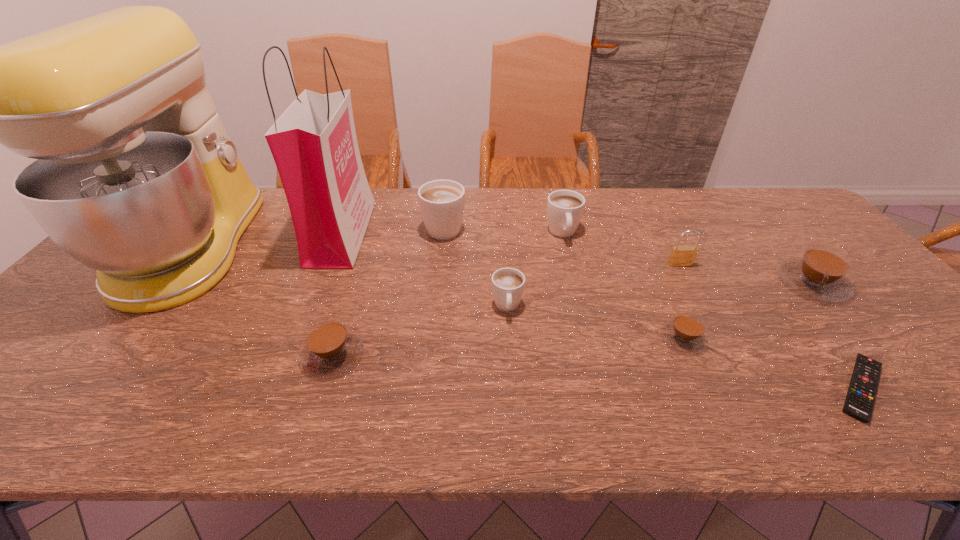
Where is `object present at the near edge`? The height and width of the screenshot is (540, 960). object present at the near edge is located at coordinates (859, 402).

At what (x,y) coordinates should I click in order to perform the action: click on object that is at the left edge. Please return your answer as a coordinate pair (x, y). Looking at the image, I should click on (136, 177).

Where is `object that is at the right edge`? The image size is (960, 540). object that is at the right edge is located at coordinates (821, 273).

Where is `object at the far left corner`? The image size is (960, 540). object at the far left corner is located at coordinates (136, 177).

The height and width of the screenshot is (540, 960). I want to click on free space at the far edge of the desktop, so click(x=678, y=194).

Identify the location of vacant region at the near edge of the desktop. (828, 421).

Locate an element on the screen. vacant space at the right edge of the desktop is located at coordinates (927, 339).

You are a GUI agent. You are given a task and a screenshot of the screen. Output one action in this format:
    pyautogui.click(x=<x>, y=<y>)
    Task: Click on the free space between the nearest white cappuccino and the brass padlock
    The height and width of the screenshot is (540, 960).
    Given the screenshot: What is the action you would take?
    pyautogui.click(x=593, y=285)

Locate an element on the screen. The image size is (960, 540). vacant area that lies between the biggest brown cappuccino and the mixer is located at coordinates (503, 265).

I want to click on vacant area between the brass padlock and the smallest white cappuccino, so click(x=593, y=285).